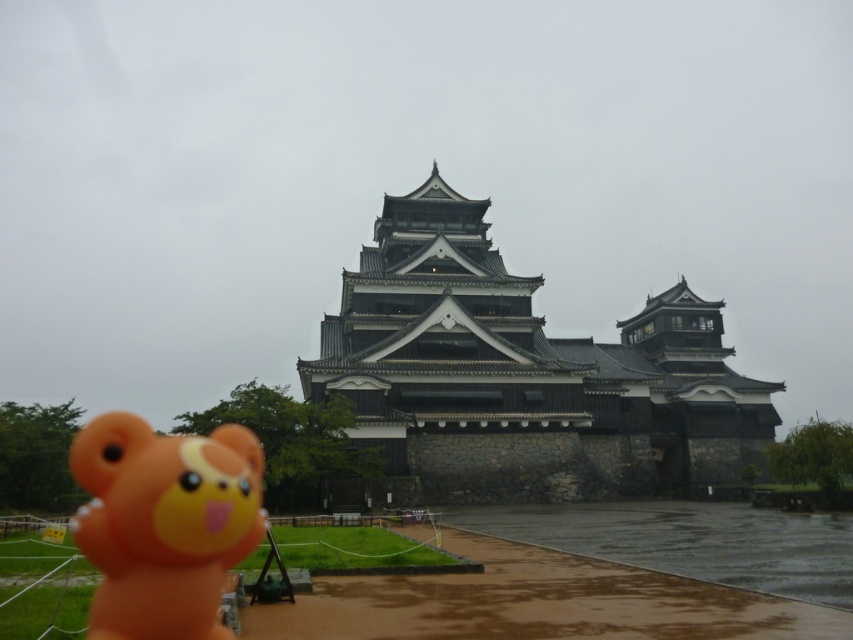
At what (x,y) coordinates should I click in order to perform the action: click on dark gray stone castle at center. Please return your answer as a coordinate pair (x, y). This screenshot has width=853, height=640. Looking at the image, I should click on (524, 372).

Is point (445, 269) positioned after point (218, 429)?

Yes, it is behind point (218, 429).

You are a GUI agent. You are given a task and a screenshot of the screen. Output one action in this format:
    pyautogui.click(x=<x>, y=<y>)
    Task: Click on the dark gray stone castle at center
    
    Given the screenshot: What is the action you would take?
    pyautogui.click(x=524, y=372)